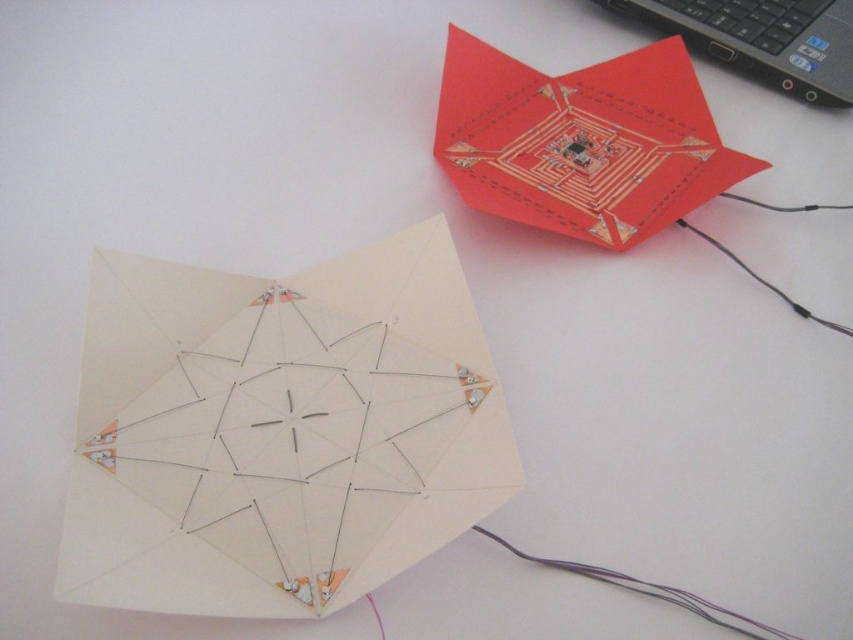
Can you confirm if black plastic laptop at upper right is wider than black rubber wire at upper right?

Yes, black plastic laptop at upper right is wider than black rubber wire at upper right.

Who is more forward, (x=781, y=12) or (x=746, y=196)?

Positioned in front is point (x=746, y=196).

What are the coordinates of `black plastic laptop at upper right` in the screenshot? It's located at (764, 38).

Who is lower down, black plastic laptop at upper right or purple wire at lower right?

purple wire at lower right

Where is `black plastic laptop at upper right`? Image resolution: width=853 pixels, height=640 pixels. black plastic laptop at upper right is located at coordinates (764, 38).

Can you confirm if purple wire at lower right is positioned below black rubber wire at upper right?

Indeed, purple wire at lower right is positioned under black rubber wire at upper right.

Can you confirm if purple wire at lower right is shorter than black rubber wire at upper right?

Yes, purple wire at lower right is shorter than black rubber wire at upper right.

Who is more distant from viewer, (688, 592) or (792, 208)?

The point (792, 208) is more distant.

The width and height of the screenshot is (853, 640). What are the coordinates of `purple wire at lower right` in the screenshot? It's located at (650, 592).